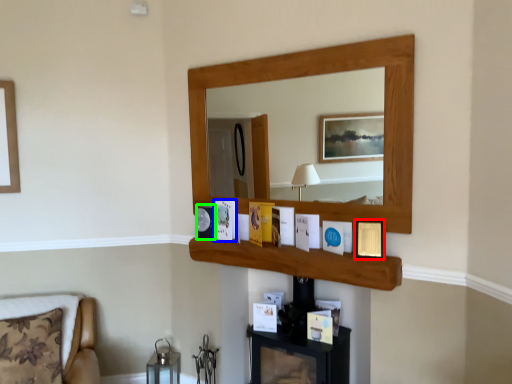
Question: Estimate the real-world distances between objects in this image. Which object is closer to picture frame (highlighted by a red box), picture frame (highlighted by a blue box) or picture frame (highlighted by a green box)?

Choices:
 (A) picture frame
 (B) picture frame

Answer: (A)